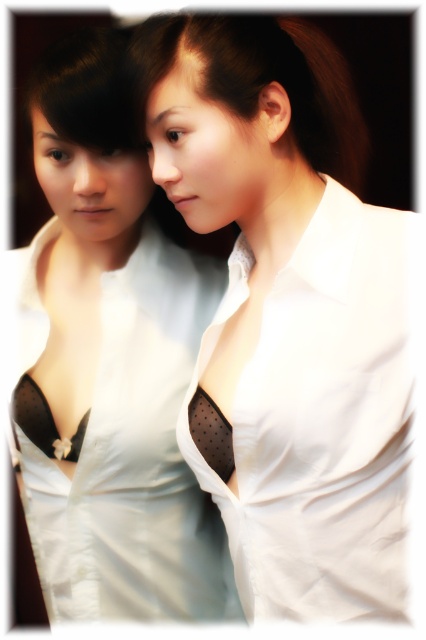
Who is lower down, white matte shirt at center or white satin blouse at center?

Positioned lower is white satin blouse at center.

Describe the element at coordinates (287, 312) in the screenshot. This screenshot has height=640, width=426. I see `white matte shirt at center` at that location.

The width and height of the screenshot is (426, 640). Identify the location of white matte shirt at center. (287, 312).

Locate an element on the screen. white matte shirt at center is located at coordinates (287, 312).

Can you confirm if white satin blouse at center is positioned above matte white blouse at center?

No, white satin blouse at center is not above matte white blouse at center.

Is white satin blouse at center to the right of matte white blouse at center from the viewer's perspective?

Incorrect, white satin blouse at center is not on the right side of matte white blouse at center.

Who is more forward, (146, 179) or (359, 177)?

Point (146, 179) is more forward.

Find the location of `white satin blouse at center`. white satin blouse at center is located at coordinates (109, 362).

Can you confirm if white matte shirt at center is taller than matte white blouse at center?

Indeed, white matte shirt at center has a greater height compared to matte white blouse at center.

In the scene shown: Who is positioned more to the right, white matte shirt at center or matte white blouse at center?

white matte shirt at center

Identify the location of white matte shirt at center. Image resolution: width=426 pixels, height=640 pixels. (287, 312).